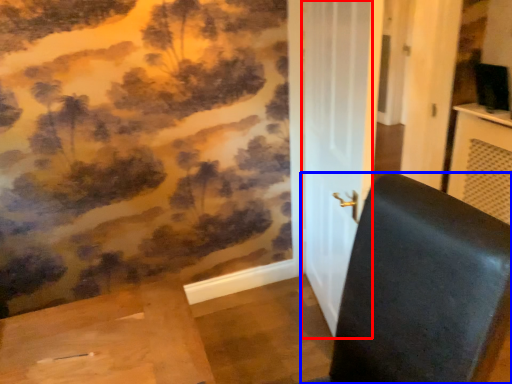
Question: Which object is further to the camera taking this photo, screen door (highlighted by a red box) or furniture (highlighted by a blue box)?

Choices:
 (A) screen door
 (B) furniture

Answer: (A)